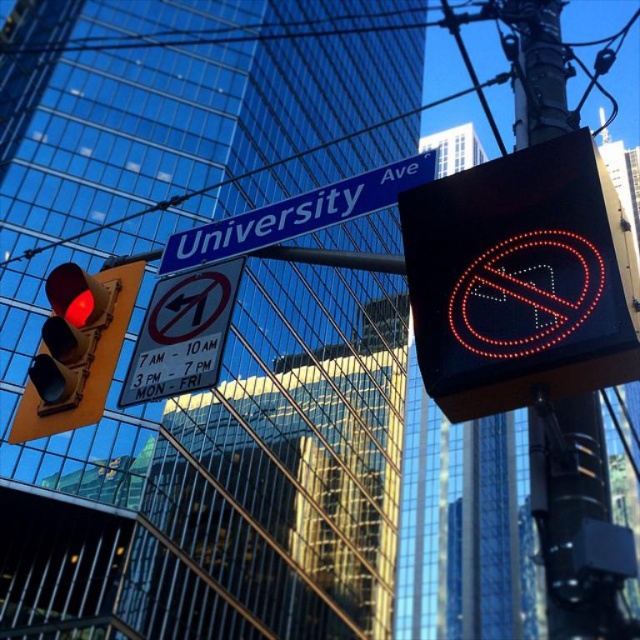
You are a delivery driver approaching an intersection with a black led sign at upper right and a blue metallic street sign at upper center. Which of these two signs is bigger?

The black led sign at upper right is larger in size than the blue metallic street sign at upper center.

You are a delivery driver approaching an intersection with a blue metallic street sign at upper center and a transparent glass power line at upper center. Which object is positioned to the left of the other?

The blue metallic street sign at upper center is to the left of the transparent glass power line at upper center.